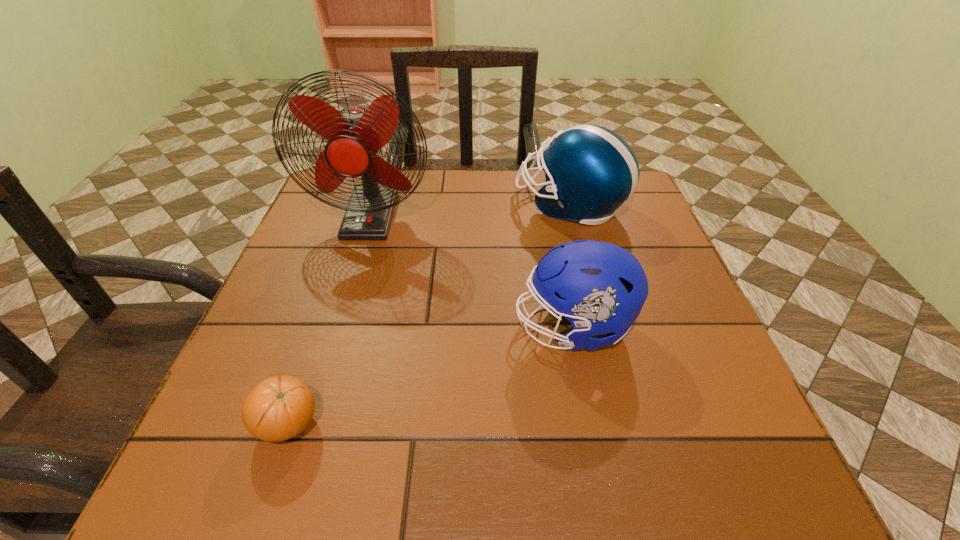
Find the location of `free location located on the face guard of the nearer football helmet`. free location located on the face guard of the nearer football helmet is located at coordinates click(x=455, y=327).

At what (x,y) coordinates should I click in order to perform the action: click on vacant space positioned 0.200m on the face guard of the nearer football helmet. Please return your answer as a coordinate pair (x, y). Looking at the image, I should click on (407, 327).

I want to click on vacant space located on the back of the orange, so click(x=330, y=303).

Where is `fan that is at the far edge`? This screenshot has width=960, height=540. fan that is at the far edge is located at coordinates (355, 135).

The width and height of the screenshot is (960, 540). I want to click on football helmet located at the far edge, so click(x=590, y=171).

Find the location of `object present at the near edge`. object present at the near edge is located at coordinates (280, 407).

You are a GUI agent. You are given a task and a screenshot of the screen. Output one action in this format:
    pyautogui.click(x=<x>, y=<y>)
    Task: Click on the fan located in the left edge section of the desktop
    This screenshot has width=960, height=540.
    Given the screenshot: What is the action you would take?
    pyautogui.click(x=355, y=135)

Locate an element on the screen. This screenshot has width=960, height=540. orange that is at the left edge is located at coordinates (280, 407).

Locate an element on the screen. This screenshot has width=960, height=540. object present at the far left corner is located at coordinates (355, 135).

Find the location of a particular element. object located in the near left corner section of the desktop is located at coordinates (280, 407).